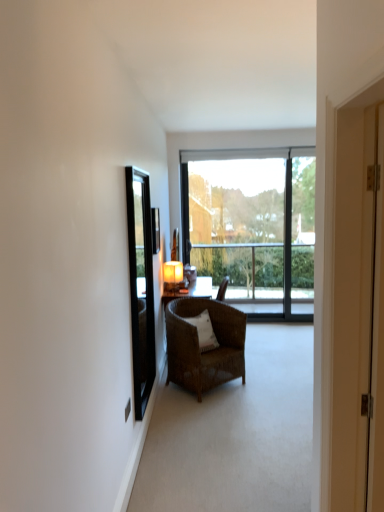
Locate an element on the screen. vacant area situated below clear glass mirror at left (from a real-world perspective) is located at coordinates (157, 426).